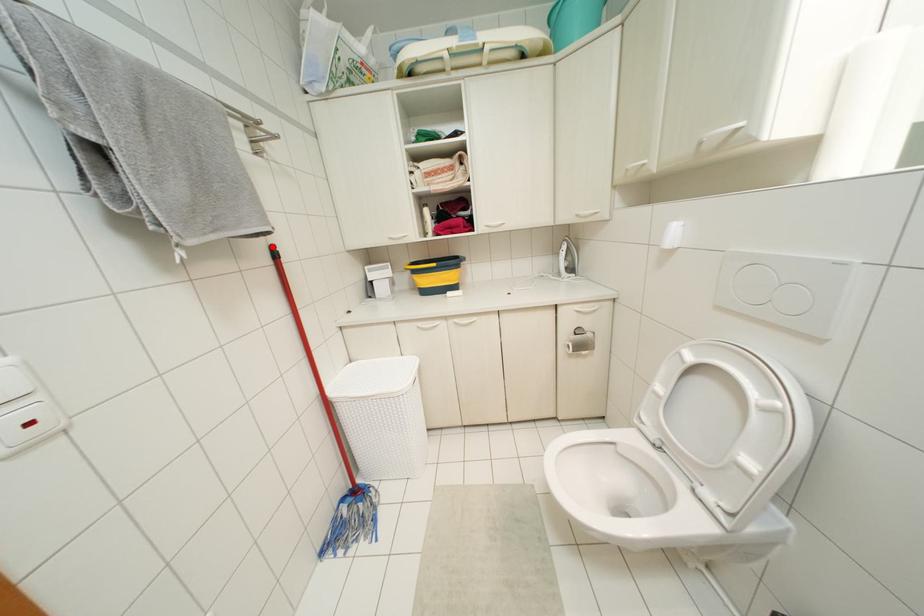
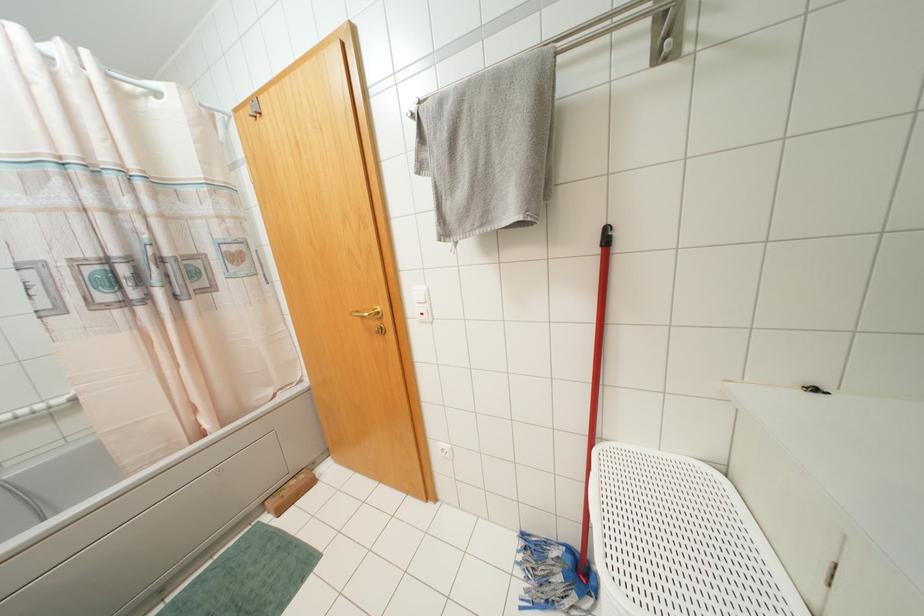
The point at the highlighted location is marked in the first image. Where is the corresponding point in the second image?

(606, 229)